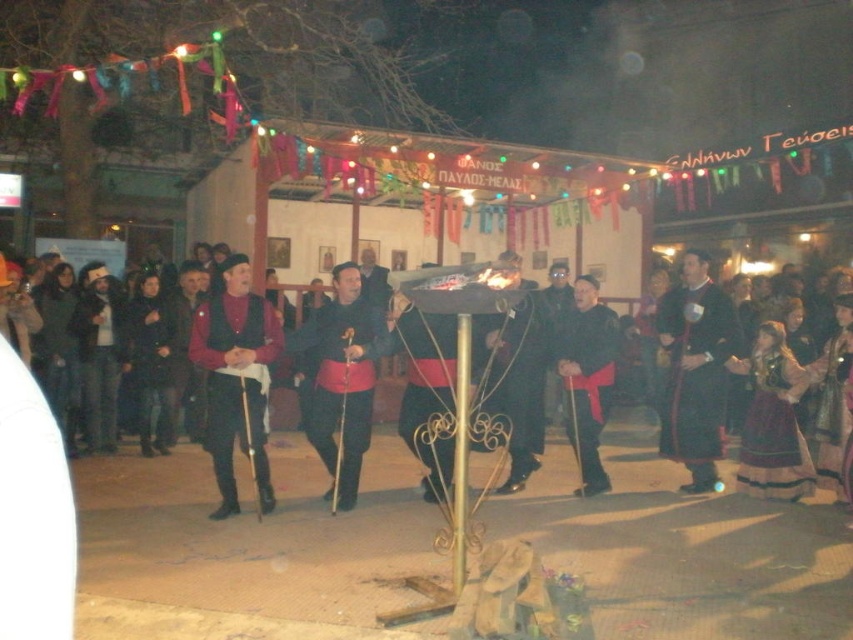
You are a photographer standing at the edge of the square. You need to capture a photo of both the dark clothing crowd at center and the matte black vest at center in the same frame. Which object should you focus on first to ensure both are in focus?

The dark clothing crowd at center has a lesser height compared to matte black vest at center, so you should focus on the matte black vest at center first to ensure both are in focus.

You are standing in the public square and see two points in the image. The first point is at coordinates point (340, 508) and the second is at point (585, 486). Which point is closer to you?

Point (340, 508) is in front of point (585, 486), so it is closer to you.

You are an observer at the event and notice two items on the central figure. The matte black vest at center and the matte black robe at center. Which one is covering the other?

The matte black vest at center is positioned over the matte black robe at center, so the vest is covering the robe.